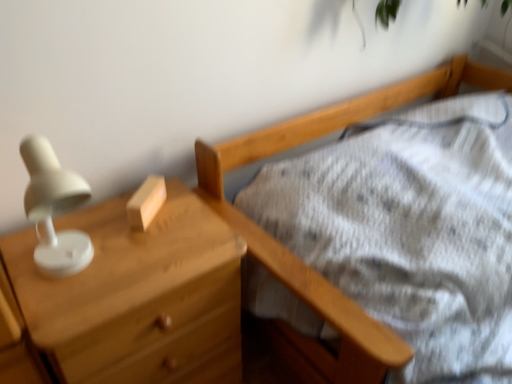
This screenshot has height=384, width=512. In order to click on vacant space in front of wooden block at center in this screenshot , I will do `click(147, 256)`.